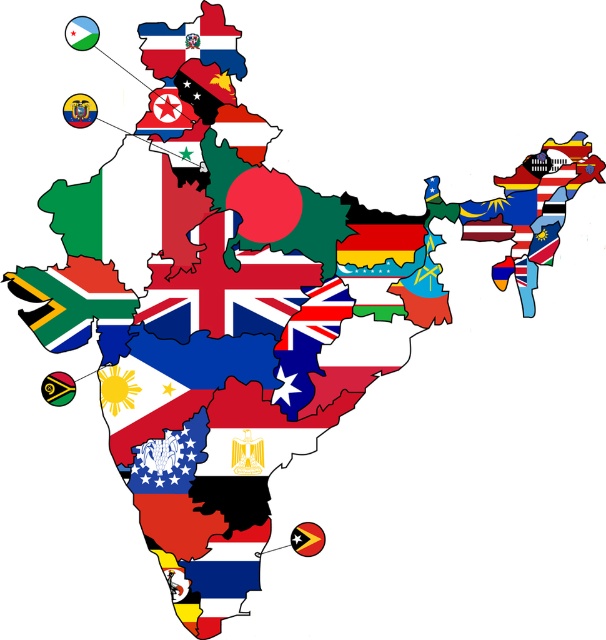
Who is lower down, blue and white striped flag at bottom left or matte red flag at upper center?

blue and white striped flag at bottom left is lower down.

Which is in front, point (90, 300) or point (171, 35)?

Positioned in front is point (171, 35).

Locate an element on the screen. The image size is (606, 640). blue and white striped flag at bottom left is located at coordinates (72, 300).

I want to click on blue and white striped flag at bottom left, so click(72, 300).